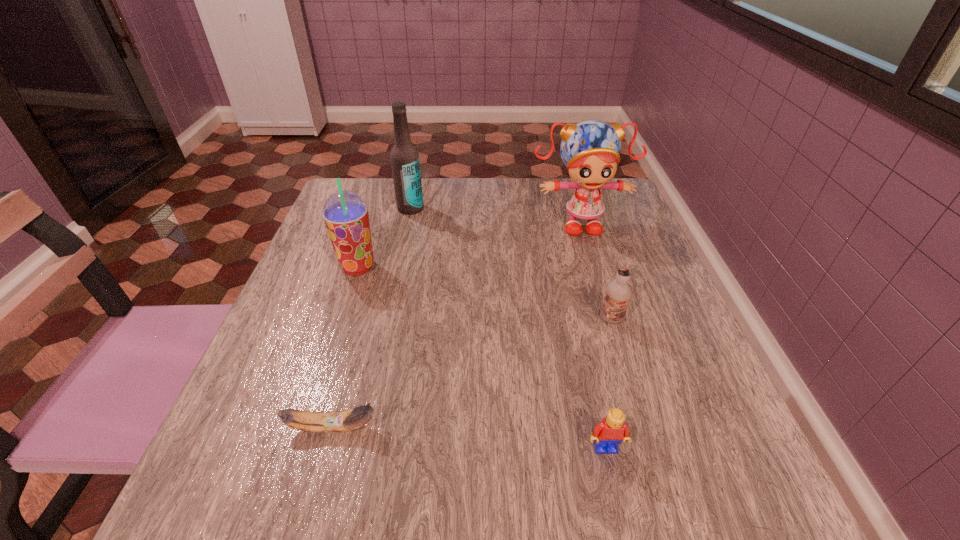
Find the location of a particular element. The height and width of the screenshot is (540, 960). beer bottle is located at coordinates (404, 157).

At what (x,y) coordinates should I click in order to perform the action: click on doll. Please return your answer as a coordinate pair (x, y). This screenshot has height=540, width=960. Looking at the image, I should click on (590, 150).

I want to click on the third farthest object, so 345,214.

This screenshot has height=540, width=960. Identify the location of smoothie. (345, 214).

This screenshot has width=960, height=540. What are the coordinates of `the fourth tallest object` in the screenshot? It's located at (619, 292).

Where is `chocolate milk`? chocolate milk is located at coordinates (619, 292).

Identify the location of the nearest object. pyautogui.click(x=608, y=434).

Find the location of `the fifth farthest object`. the fifth farthest object is located at coordinates (337, 421).

Find the location of `banana`. banana is located at coordinates (337, 421).

This screenshot has height=540, width=960. Identify the location of vacant space located on the label of the beer bottle. (388, 313).